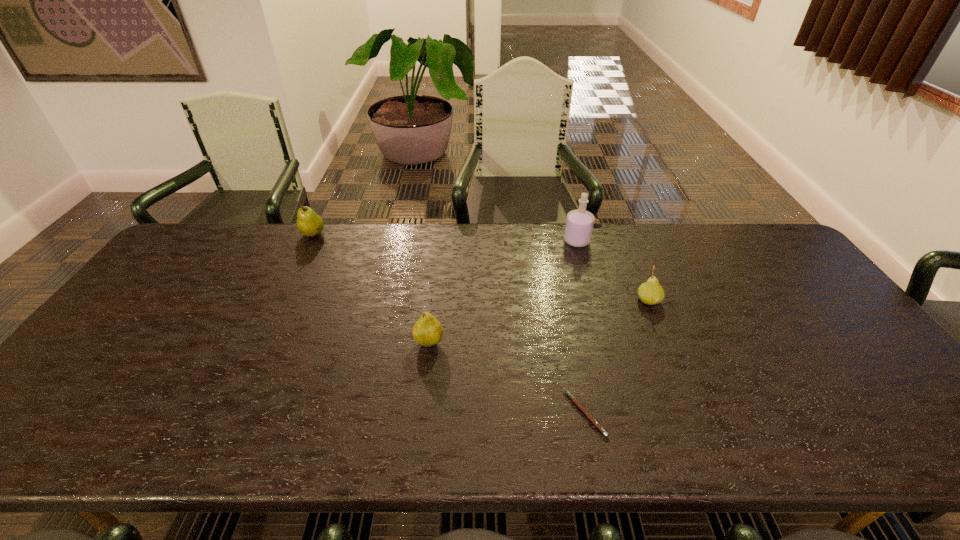
I want to click on the fourth object from left to right, so click(x=579, y=224).

What are the coordinates of `perfume` in the screenshot? It's located at (579, 224).

This screenshot has width=960, height=540. Find the location of `the leftmost pear`. the leftmost pear is located at coordinates (309, 223).

Locate an element on the screen. This screenshot has height=540, width=960. the farthest pear is located at coordinates (309, 223).

Where is `the rightmost object`? Image resolution: width=960 pixels, height=540 pixels. the rightmost object is located at coordinates (651, 293).

Find the location of a particular element. the rightmost pear is located at coordinates (651, 293).

At what (x,y) coordinates should I click in order to perform the action: click on the fourth farthest object. Please return your answer as a coordinate pair (x, y). Image resolution: width=960 pixels, height=540 pixels. Looking at the image, I should click on (427, 331).

Find the location of `the second object from left to right`. the second object from left to right is located at coordinates point(427,331).

Locate an element on the screen. pen is located at coordinates (573, 399).

Where is `the nearest object`? This screenshot has height=540, width=960. the nearest object is located at coordinates (573, 399).